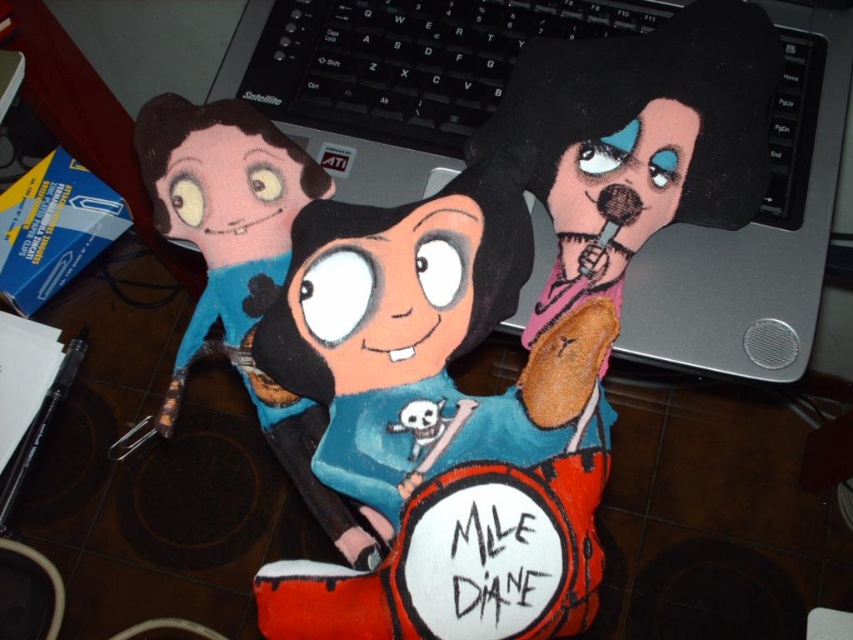
You are standing in front of the laptop and want to reach the point marked as point (770, 44). Is this point closer to you or farther away compared to the foreground plush toy in center?

The point (770, 44) is 24.08 inches from the viewer, so it is farther away than the foreground plush toy in center which is in the foreground and thus closer.

You are trying to place a new keyboard that is 21 centimeters long between the silver metallic laptop at center and the soft plush doll at center. Will the keyboard fit between them?

The silver metallic laptop at center and the soft plush doll at center are 20.93 centimeters apart. Since the keyboard is 21 centimeters long, it will not fit between them as the distance is slightly shorter than the keyboard.